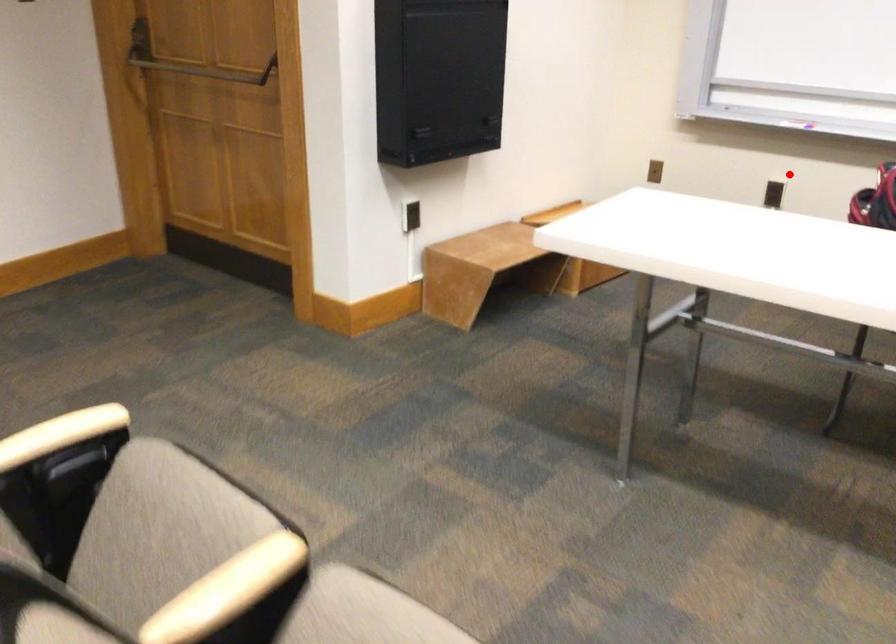
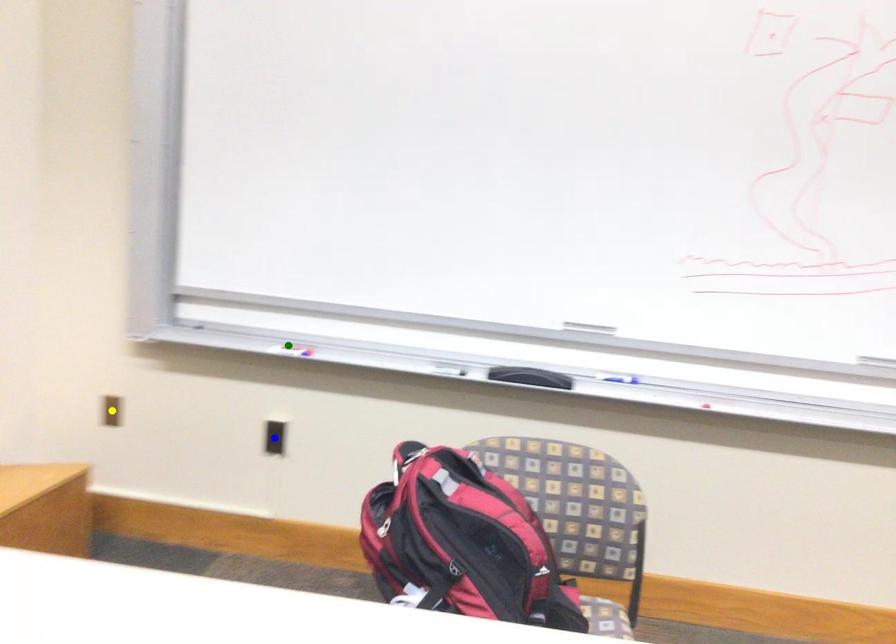
Question: I am providing you with two images of the same scene from different viewpoints. A red point is marked on the first image. You are given multiple points on the second image. In image 2, which mark is for the same physical point as the one in image 1?

Choices:
 (A) yellow point
 (B) blue point
 (C) green point

Answer: (B)